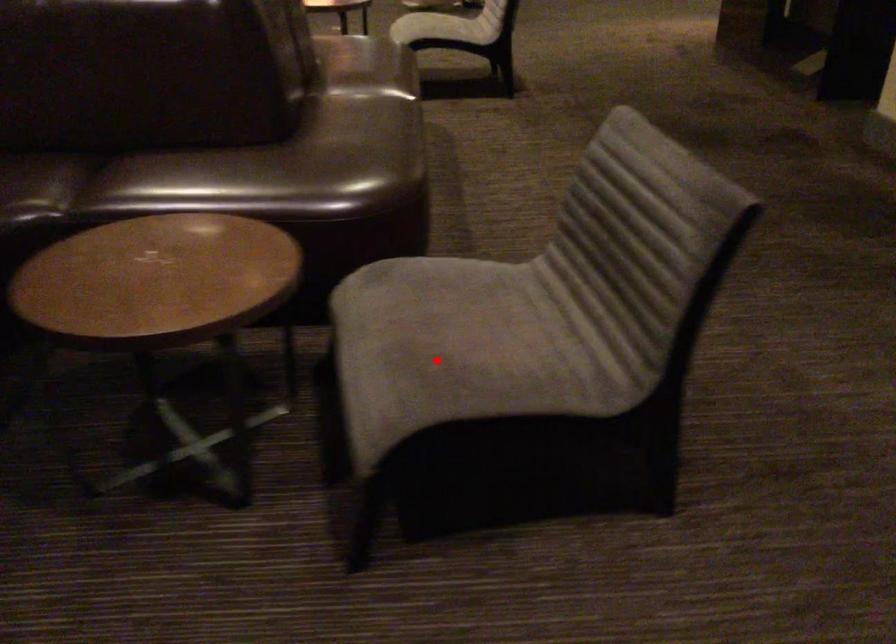
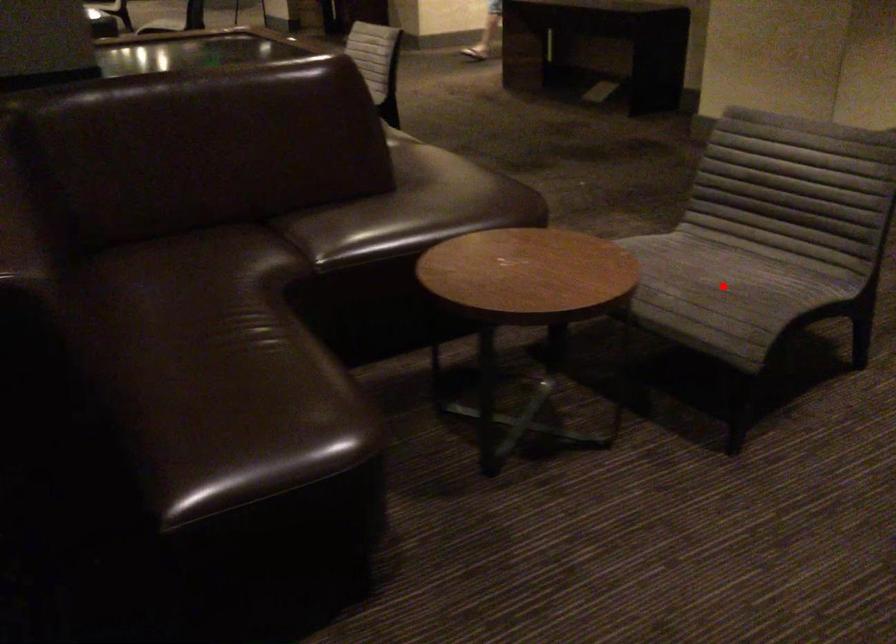
I am providing you with two images of the same scene from different viewpoints. A red point is marked on the first image and another point is marked on the second image. Is the marked point in image1 the same physical position as the marked point in image2?

Yes